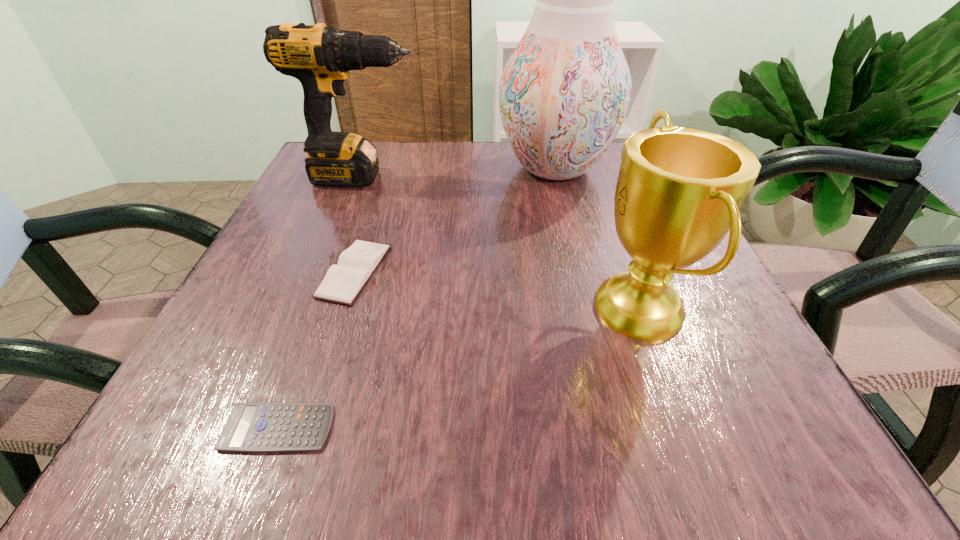
Identify the location of object that ranks as the third closest to the diary. The height and width of the screenshot is (540, 960). (564, 93).

Choose which object is the fourth nearest neighbor to the calculator. Please provide its 2D coordinates. Your answer should be formatted as a tuple, i.e. [(x, y)], where the tuple contains the x and y coordinates of a point satisfying the conditions above.

[(564, 93)]

At what (x,y) coordinates should I click in order to perform the action: click on free space that satisfies the following two spatial constraints: 1. at the tip of the drill; 2. on the left side of the shortest object. Please return your answer as a coordinate pair (x, y). The width and height of the screenshot is (960, 540). Looking at the image, I should click on (265, 428).